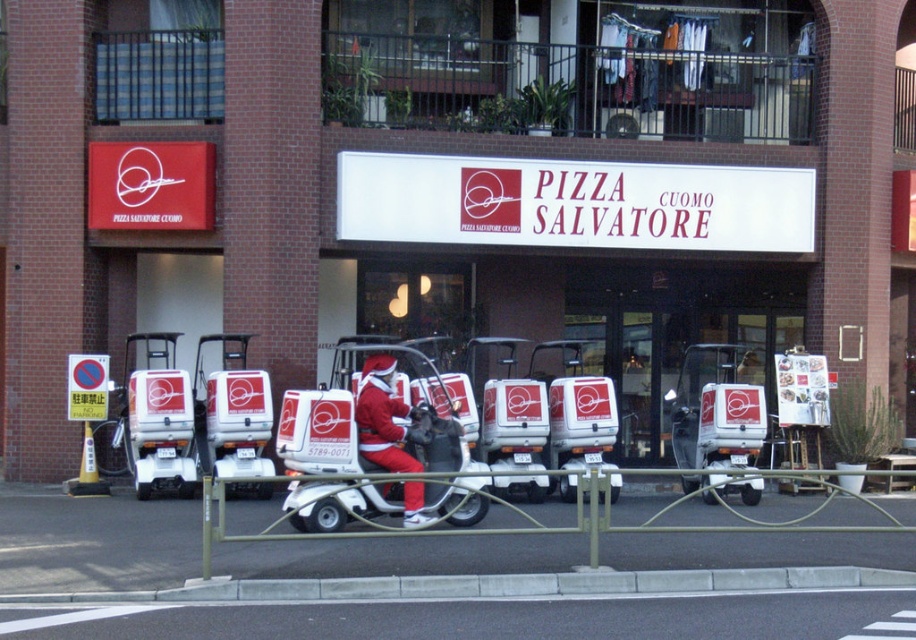
Which is below, white matte golf cart at center or santa claus costume at center?

white matte golf cart at center is lower down.

Can you confirm if white matte golf cart at center is thinner than santa claus costume at center?

No, white matte golf cart at center is not thinner than santa claus costume at center.

Is point (281, 435) positioned after point (424, 522)?

Yes, it is behind point (424, 522).

Locate an element on the screen. The height and width of the screenshot is (640, 916). white matte golf cart at center is located at coordinates (373, 417).